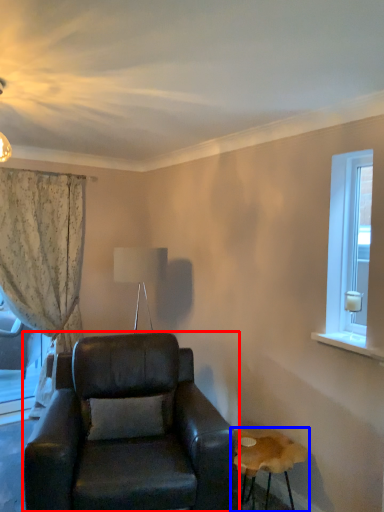
Question: Among these objects, which one is nearest to the camera, chair (highlighted by a red box) or table (highlighted by a blue box)?

Choices:
 (A) chair
 (B) table

Answer: (A)